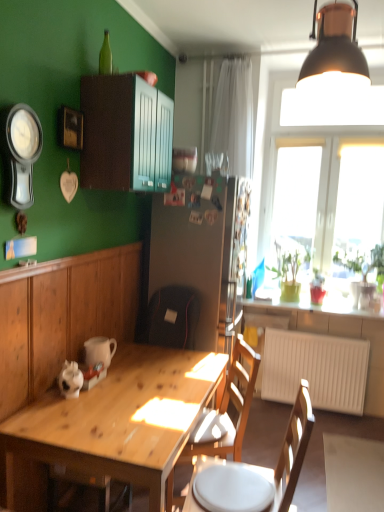
Where is `beige plastic radiator at lower right`? beige plastic radiator at lower right is located at coordinates (315, 369).

Measure the distance between matte wood cabinet at upper center, which is counted as the 1th cabinetry, starting from the top, and camera.

2.16 meters.

Measure the distance between point (100,163) and camera.

Point (100,163) and camera are 7.51 feet apart from each other.

Image resolution: width=384 pixels, height=512 pixels. Describe the element at coordinates (287, 277) in the screenshot. I see `green matte plant at window, which is counted as the 2th houseplant, starting from the front` at that location.

Measure the distance between point (183,500) and camera.

The depth of point (183,500) is 5.94 feet.

The width and height of the screenshot is (384, 512). In order to click on green glossy plant at window, the 2th houseplant positioned from the back in this screenshot , I will do click(364, 262).

Is metallic silver bowl at upper center next to transparent glass window at upper right?

There is a gap between metallic silver bowl at upper center and transparent glass window at upper right.

Between metallic silver bowl at upper center and transparent glass window at upper right, which one has smaller size?

Smaller between the two is metallic silver bowl at upper center.

From a real-world perspective, is metallic silver bowl at upper center below transparent glass window at upper right?

Incorrect, from a real-world perspective, metallic silver bowl at upper center is higher than transparent glass window at upper right.

Who is more distant, transparent glass window at upper right or wooden desk at lower left?

transparent glass window at upper right is more distant.

From their relative heights in the image, would you say transparent glass window at upper right is taller or shorter than wooden desk at lower left?

In the image, transparent glass window at upper right appears to be taller than wooden desk at lower left.

Looking at this image, is transparent glass window at upper right in contact with wooden desk at lower left?

They are not placed beside each other.

Considering the sizes of objects transparent glass window at upper right and wooden desk at lower left in the image provided, who is smaller, transparent glass window at upper right or wooden desk at lower left?

With smaller size is transparent glass window at upper right.

Considering the sizes of objects metallic silver bowl at upper center and wooden table at lower left, which is the second cabinetry in top-to-bottom order, in the image provided, who is taller, metallic silver bowl at upper center or wooden table at lower left, which is the second cabinetry in top-to-bottom order,?

wooden table at lower left, which is the second cabinetry in top-to-bottom order.

In the scene shown: Can you confirm if metallic silver bowl at upper center is wider than wooden table at lower left, which appears as the first cabinetry when ordered from the bottom?

Indeed, metallic silver bowl at upper center has a greater width compared to wooden table at lower left, which appears as the first cabinetry when ordered from the bottom.

Is metallic silver bowl at upper center oriented away from wooden table at lower left, which appears as the first cabinetry when ordered from the bottom?

No, metallic silver bowl at upper center is not facing the opposite direction of wooden table at lower left, which appears as the first cabinetry when ordered from the bottom.

What's the angular difference between metallic silver bowl at upper center and wooden table at lower left, which appears as the first cabinetry when ordered from the bottom,'s facing directions?

The angular difference between metallic silver bowl at upper center and wooden table at lower left, which appears as the first cabinetry when ordered from the bottom, is 12.3 degrees.

Considering the relative positions of wooden at center, the second chair viewed from the front, and wooden table at lower left, which appears as the first cabinetry when ordered from the bottom, in the image provided, is wooden at center, the second chair viewed from the front, in front of wooden table at lower left, which appears as the first cabinetry when ordered from the bottom,?

That is False.

Which of these two, wooden at center, the 1th chair when ordered from back to front, or wooden table at lower left, which appears as the first cabinetry when ordered from the bottom, is thinner?

wooden table at lower left, which appears as the first cabinetry when ordered from the bottom.

Is wooden at center, the 1th chair when ordered from back to front, turned away from wooden table at lower left, which is the second cabinetry in top-to-bottom order?

No, wooden at center, the 1th chair when ordered from back to front,'s orientation is not away from wooden table at lower left, which is the second cabinetry in top-to-bottom order.

Is metallic silver bowl at upper center next to matte white mug at lower left and touching it?

They are not placed beside each other.

From the image's perspective, is metallic silver bowl at upper center above or below matte white mug at lower left?

Clearly, from the image's perspective, metallic silver bowl at upper center is above matte white mug at lower left.

Does metallic silver bowl at upper center have a lesser height compared to matte white mug at lower left?

No, metallic silver bowl at upper center is not shorter than matte white mug at lower left.

In the scene shown: Who is smaller, metallic silver bowl at upper center or matte white mug at lower left?

With smaller size is matte white mug at lower left.

Is wooden picture frame at upper left located within wooden at center, the 1th chair when ordered from back to front?

That's incorrect, wooden picture frame at upper left is not inside wooden at center, the 1th chair when ordered from back to front.

Considering the sizes of wooden at center, the second chair viewed from the front, and wooden picture frame at upper left in the image, is wooden at center, the second chair viewed from the front, bigger or smaller than wooden picture frame at upper left?

wooden at center, the second chair viewed from the front, is bigger than wooden picture frame at upper left.

Which of these two, wooden at center, the 1th chair when ordered from back to front, or wooden picture frame at upper left, stands shorter?

wooden picture frame at upper left.

Between matte white mug at lower left and beige plastic radiator at lower right, which one has less height?

Standing shorter between the two is matte white mug at lower left.

Would you say matte white mug at lower left is to the left or to the right of beige plastic radiator at lower right in the picture?

matte white mug at lower left is positioned on beige plastic radiator at lower right's left side.

From a real-world perspective, which is physically below, matte white mug at lower left or beige plastic radiator at lower right?

beige plastic radiator at lower right.

Is matte white mug at lower left far away from beige plastic radiator at lower right?

matte white mug at lower left is positioned a significant distance from beige plastic radiator at lower right.

The width and height of the screenshot is (384, 512). I want to click on bowl that is in front of the transparent glass window at upper right, so click(x=184, y=160).

Locate an element on the screen. This screenshot has height=512, width=384. window to the right of wooden desk at lower left is located at coordinates tap(299, 145).

Looking at the image, which one is located further to transparent glass window at upper right, smooth white countertop at window or wooden chair at center, the second chair when ordered from back to front?

wooden chair at center, the second chair when ordered from back to front, lies further to transparent glass window at upper right than the other object.

Estimate the real-world distances between objects in this image. Which object is further from black matte lampshade at upper right, wooden at center, the second chair viewed from the front, or green matte plant at window, which is counted as the 2th houseplant, starting from the front?

Based on the image, wooden at center, the second chair viewed from the front, appears to be further to black matte lampshade at upper right.

From the image, which object appears to be nearer to wooden table at lower left, which is the second cabinetry in top-to-bottom order, wooden picture frame at upper left or transparent glass window at upper right?

wooden picture frame at upper left.

Looking at the image, which one is located closer to green glossy plant at window, the 2th houseplant positioned from the back, black matte lampshade at upper right or transparent glass window at upper right?

Among the two, transparent glass window at upper right is located nearer to green glossy plant at window, the 2th houseplant positioned from the back.

From the image, which object appears to be nearer to wooden picture frame at upper left, metallic silver clock at upper left or black matte lampshade at upper right?

Based on the image, metallic silver clock at upper left appears to be nearer to wooden picture frame at upper left.

Considering their positions, is wooden chair at center, the second chair when ordered from back to front, positioned closer to wooden at center, the second chair viewed from the front, than matte wood cabinet at upper center, which is counted as the 1th cabinetry, starting from the top?

The object closer to wooden at center, the second chair viewed from the front, is wooden chair at center, the second chair when ordered from back to front.

From the image, which object appears to be farther from wooden picture frame at upper left, beige plastic radiator at lower right or metallic silver clock at upper left?

Based on the image, beige plastic radiator at lower right appears to be further to wooden picture frame at upper left.

Considering their positions, is transparent glass window at upper right positioned further to green glossy plant at window, which appears as the first houseplant when viewed from the front, than black matte lampshade at upper right?

black matte lampshade at upper right is further to green glossy plant at window, which appears as the first houseplant when viewed from the front.

I want to click on houseplant between wooden at center, the 1th chair when ordered from back to front, and beige plastic radiator at lower right in the front-back direction, so click(x=364, y=262).

Find the location of a particular element. This screenshot has height=512, width=384. bowl positioned between wooden chair at center, arranged as the 1th chair when viewed from the front, and transparent glass window at upper right from near to far is located at coordinates (184, 160).

You are a GUI agent. You are given a task and a screenshot of the screen. Output one action in this format:
    pyautogui.click(x=<x>, y=<y>)
    Task: Click on the coffee cup between wooden table at lower left, which appears as the first cabinetry when ordered from the bottom, and green matte plant at window, the 1th houseplant in the back-to-front sequence, along the z-axis
    This screenshot has height=512, width=384.
    Given the screenshot: What is the action you would take?
    pyautogui.click(x=99, y=351)

Identify the location of window that lies between matte wood cabinet at upper center, which appears as the 2th cabinetry when ordered from the bottom, and beige plastic radiator at lower right from top to bottom. tap(299, 145).